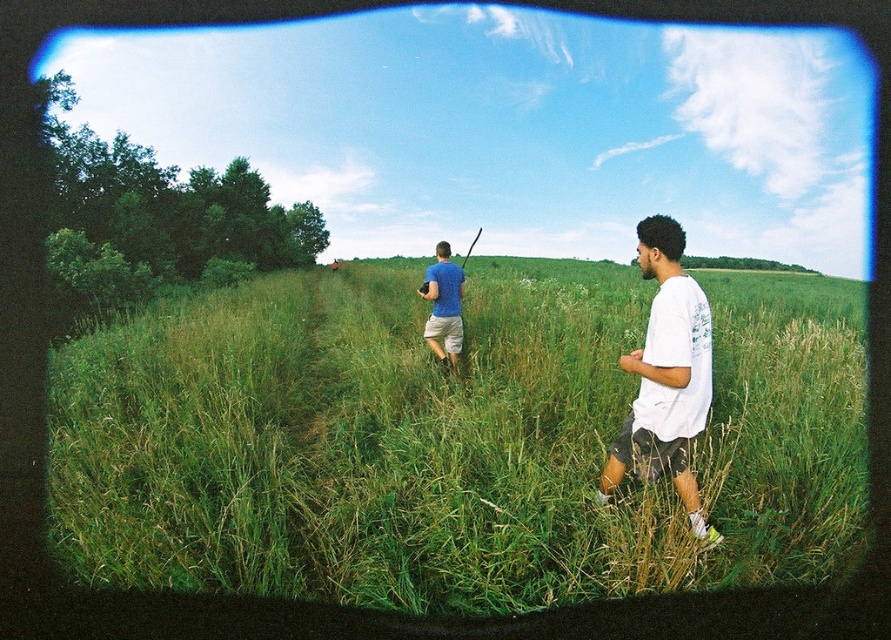
Does green grass at center have a greater height compared to matte blue t-shirt at center?

Yes.

Does point (270, 310) lie in front of point (430, 282)?

No, (270, 310) is behind (430, 282).

Is point (683, 577) less distant than point (452, 276)?

Yes, it is in front of point (452, 276).

This screenshot has height=640, width=891. What are the coordinates of `green grass at center` in the screenshot? It's located at (450, 440).

Between point (650, 266) and point (448, 326), which one is positioned behind?

The point (448, 326) is behind.

Is white cotton t-shirt at right thinner than matte blue t-shirt at center?

Incorrect, white cotton t-shirt at right's width is not less than matte blue t-shirt at center's.

Measure the distance between point (677, 448) and camera.

Point (677, 448) and camera are 3.36 meters apart.

The height and width of the screenshot is (640, 891). Identify the location of white cotton t-shirt at right. (666, 376).

Does point (350, 348) come farther from viewer compared to point (701, 410)?

Yes, point (350, 348) is behind point (701, 410).

Locate an element on the screen. green grass at center is located at coordinates (450, 440).

This screenshot has height=640, width=891. I want to click on green grass at center, so click(x=450, y=440).